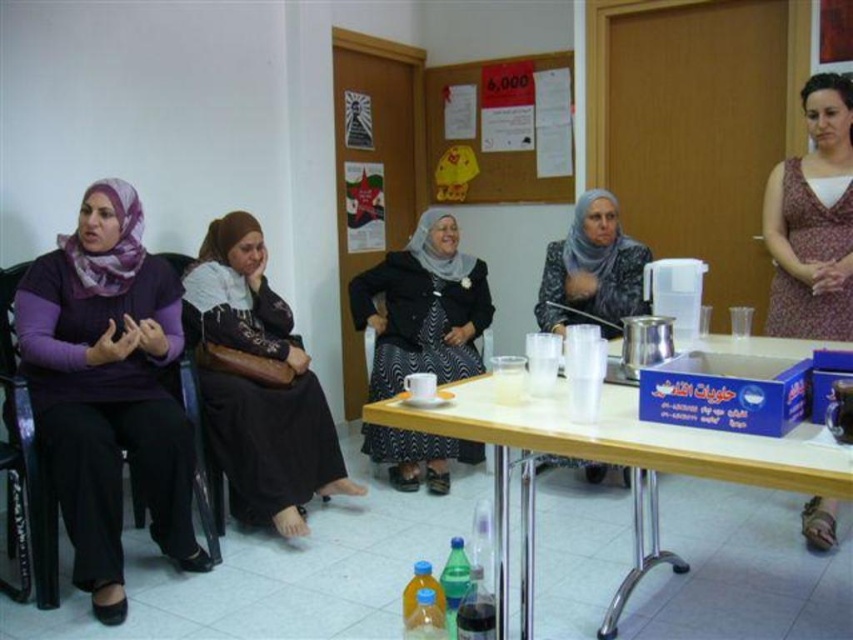
Question: Based on their relative distances, which object is farther from the wooden table at center?

Choices:
 (A) black fabric dress at left
 (B) purple matte hijab at left
 (C) matte black hijab at center
 (D) wooden corkboard at upper center

Answer: (D)

Question: Is black fabric dress at left smaller than wooden corkboard at upper center?

Choices:
 (A) no
 (B) yes

Answer: (A)

Question: Among these objects, which one is farthest from the camera?

Choices:
 (A) black textured dress at center
 (B) wooden corkboard at upper center
 (C) wooden table at center

Answer: (B)

Question: Is the position of purple matte hijab at left more distant than that of black textured dress at center?

Choices:
 (A) yes
 (B) no

Answer: (B)

Question: Can you confirm if wooden table at center is bigger than printed fabric dress at center?

Choices:
 (A) no
 (B) yes

Answer: (B)

Question: Among these points, which one is nearest to the camera?

Choices:
 (A) (375, 394)
 (B) (236, 456)

Answer: (B)